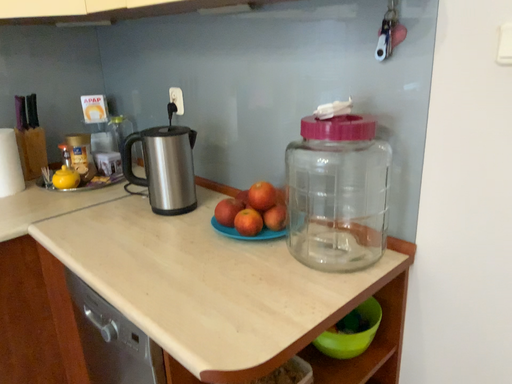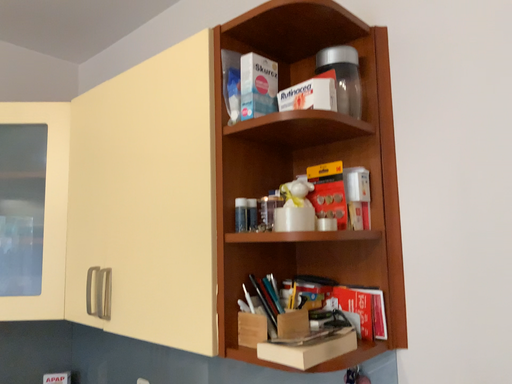
Question: Which way did the camera rotate in the video?

Choices:
 (A) rotated upward
 (B) rotated downward

Answer: (A)